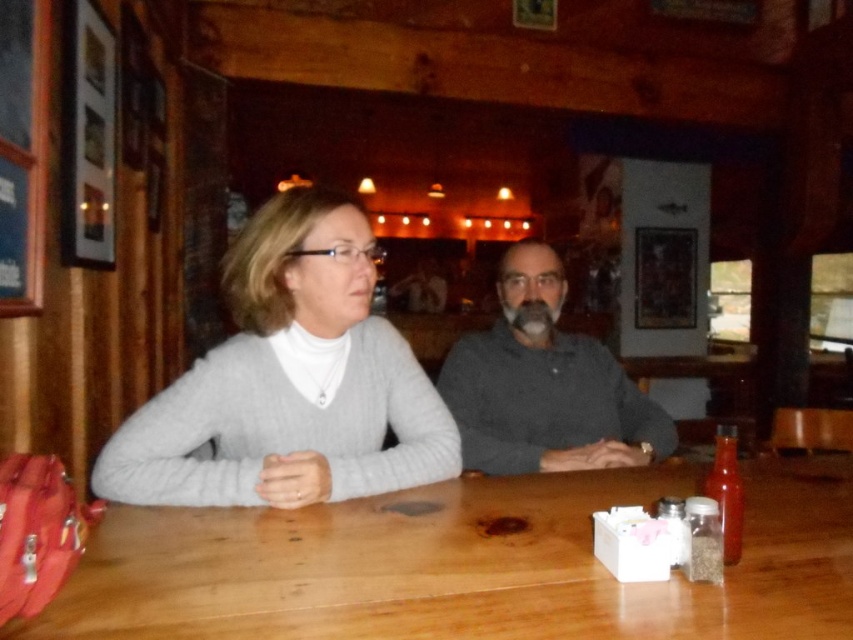
You are a server at the rustic restaurant and need to place a 1.2 meter long tray of appetizers on the wooden table at center. Considering the table is to the right of the gray knitted sweater at center, will there be enough space to place the tray without it hanging off the edge?

The wooden table at center is positioned to the right of the gray knitted sweater at center. However, the description does not provide specific measurements of the table size or its distance from the sweater, so it is unclear if the 1.2 meter tray will fit without overhanging. Additional information about the table dimensions or available space is needed to determine this.

You are a waiter in a rustic restaurant. You need to place a new menu on the wooden table at center without it blocking the gray matte sweater at center. Is this possible?

The wooden table at center is positioned under the gray matte sweater at center, so placing the menu on the table would not block the sweater since it is already under it.

You are a server in a rustic restaurant and need to place a new menu on the table. The menu is 12 inches wide. Can you fit it on the wooden table at center without overlapping the gray knitted sweater at center?

→ The wooden table at center might be wider than gray knitted sweater at center, so there is a possibility that the menu can be placed without overlapping, but the exact width difference isn not specified. Please check the actual dimensions before placing the menu.